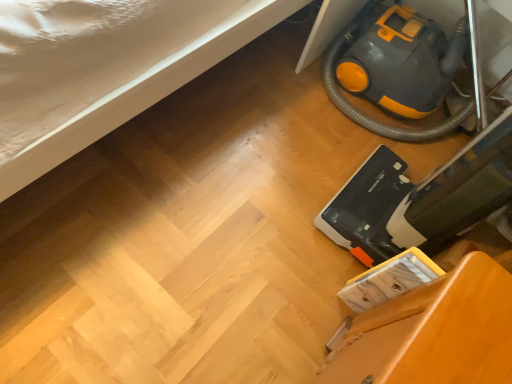
You are a GUI agent. You are given a task and a screenshot of the screen. Output one action in this format:
    pyautogui.click(x=<x>, y=<y>)
    Task: Click on the vacant space situated on the left part of yellow-orange plastic vacuum cleaner at lower right, the second equipment when ordered from back to front
    
    Given the screenshot: What is the action you would take?
    pyautogui.click(x=290, y=185)